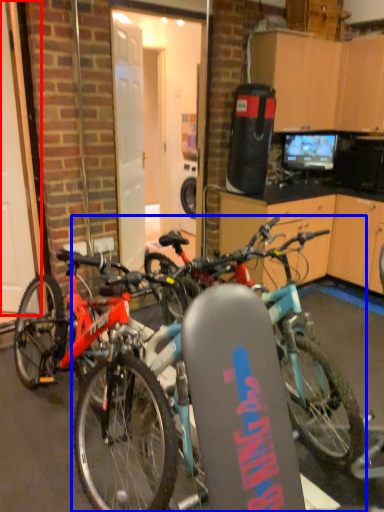
Question: Which object is closer to the camera taking this photo, garage door (highlighted by a red box) or bicycle (highlighted by a blue box)?

Choices:
 (A) garage door
 (B) bicycle

Answer: (B)